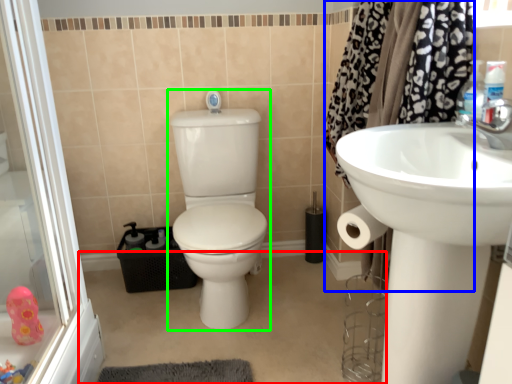
Question: Estimate the real-world distances between objects in this image. Which object is farther from plain (highlighted by a red box), shower curtain (highlighted by a blue box) or sit (highlighted by a green box)?

Choices:
 (A) shower curtain
 (B) sit

Answer: (A)